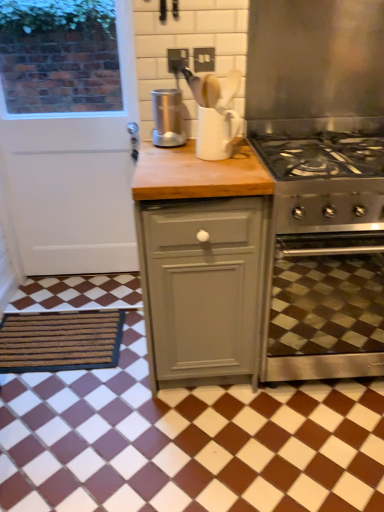
The height and width of the screenshot is (512, 384). Identify the location of vacant space situated on the left part of matte gray cabinet at center. (94, 389).